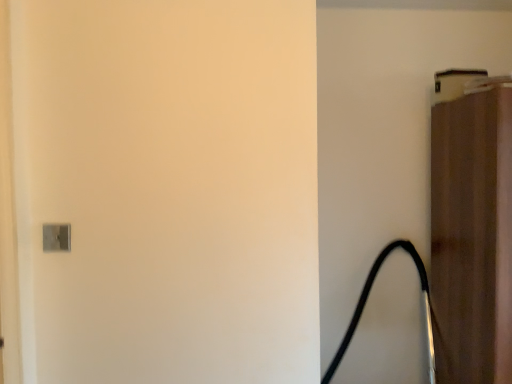
Question: Does brown fabric door at upper right have a greater width compared to black rubber hose at right?

Choices:
 (A) no
 (B) yes

Answer: (A)

Question: Considering the relative sizes of brown fabric door at upper right and black rubber hose at right in the image provided, is brown fabric door at upper right bigger than black rubber hose at right?

Choices:
 (A) no
 (B) yes

Answer: (B)

Question: Is brown fabric door at upper right smaller than black rubber hose at right?

Choices:
 (A) yes
 (B) no

Answer: (B)

Question: From a real-world perspective, is brown fabric door at upper right physically above black rubber hose at right?

Choices:
 (A) yes
 (B) no

Answer: (A)

Question: From the image's perspective, would you say brown fabric door at upper right is positioned over black rubber hose at right?

Choices:
 (A) no
 (B) yes

Answer: (B)

Question: Considering the relative sizes of brown fabric door at upper right and black rubber hose at right in the image provided, is brown fabric door at upper right shorter than black rubber hose at right?

Choices:
 (A) no
 (B) yes

Answer: (A)

Question: Is black rubber hose at right far away from brown fabric door at upper right?

Choices:
 (A) no
 (B) yes

Answer: (A)

Question: Considering the relative sizes of black rubber hose at right and brown fabric door at upper right in the image provided, is black rubber hose at right shorter than brown fabric door at upper right?

Choices:
 (A) yes
 (B) no

Answer: (A)

Question: Does black rubber hose at right have a greater width compared to brown fabric door at upper right?

Choices:
 (A) no
 (B) yes

Answer: (B)

Question: From a real-world perspective, is black rubber hose at right on brown fabric door at upper right?

Choices:
 (A) yes
 (B) no

Answer: (B)

Question: From the image's perspective, does black rubber hose at right appear higher than brown fabric door at upper right?

Choices:
 (A) no
 (B) yes

Answer: (A)

Question: Is the position of black rubber hose at right more distant than that of brown fabric door at upper right?

Choices:
 (A) yes
 (B) no

Answer: (A)

Question: From a real-world perspective, is brown fabric door at upper right physically located above or below black rubber hose at right?

Choices:
 (A) above
 (B) below

Answer: (A)